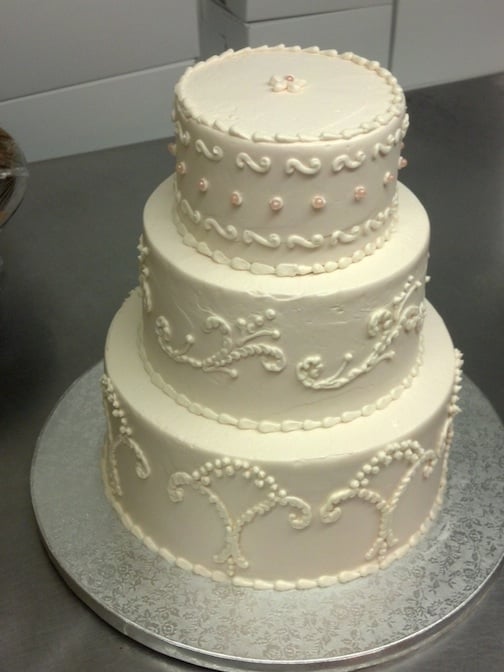
Where is `decorative, silver cake base`? The height and width of the screenshot is (672, 504). decorative, silver cake base is located at coordinates (65, 562), (81, 472), (322, 610), (204, 630), (488, 525), (491, 431), (374, 642).